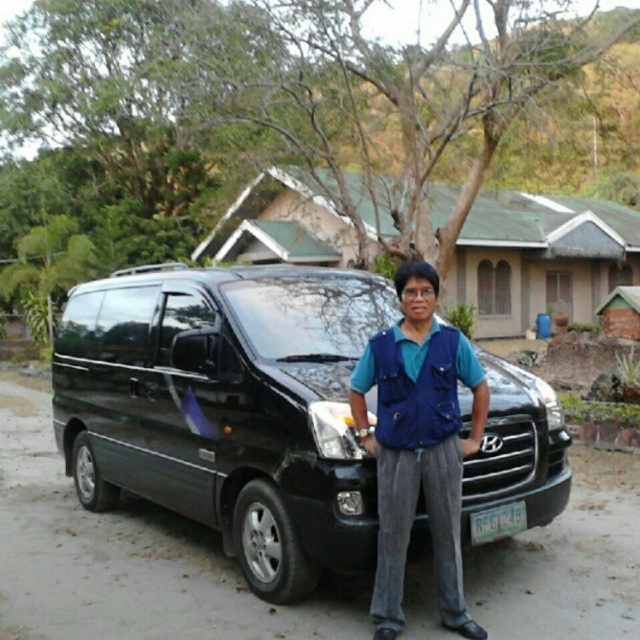
You are a delivery person who needs to attach a sticker to either the blue fabric vest at center or the white plastic license plate at center. The sticker is 12 cm in width. Which object can the sticker fit on without overlapping its edges?

The blue fabric vest at center is larger in size than the white plastic license plate at center. Since the sticker is 12 cm wide, it can fit on the blue fabric vest at center without overlapping its edges.

You are a delivery person who needs to deliver a package to the address on the white plastic license plate at center. The black matte van at center is blocking the path. Can you move the van to access the license plate?

The black matte van at center is to the right of white plastic license plate at center, so moving the van to the left would allow access to the license plate.